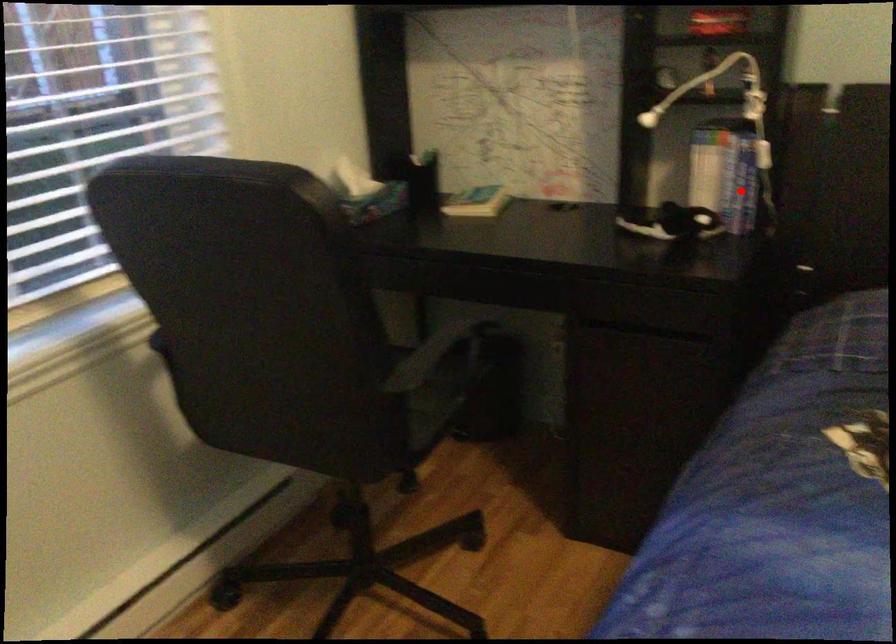
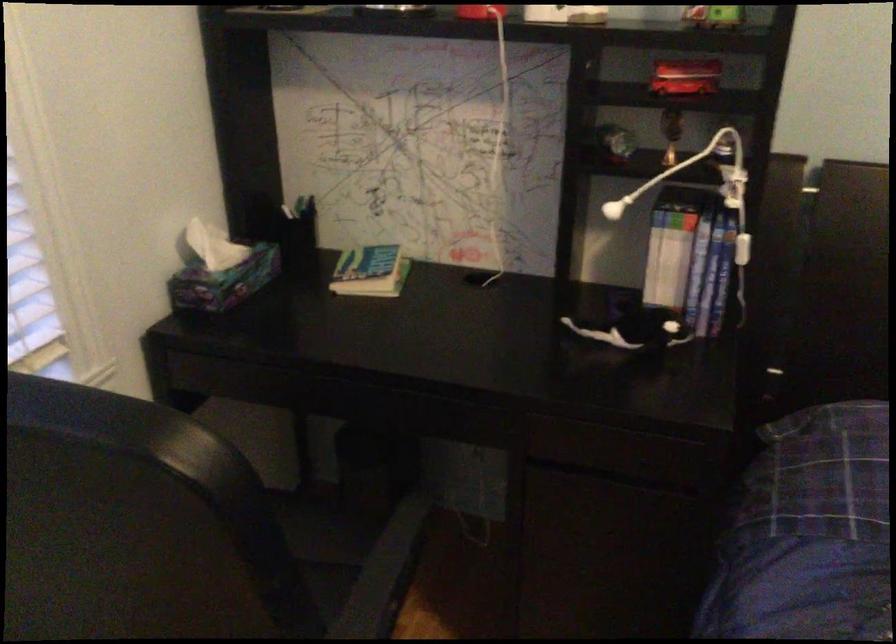
Question: A red point is marked in image1. In image2, is the corresponding 3D point closer to the camera or farther? Reply with the corresponding letter.

Choices:
 (A) The corresponding 3D point is closer.
 (B) The corresponding 3D point is farther.

Answer: (A)